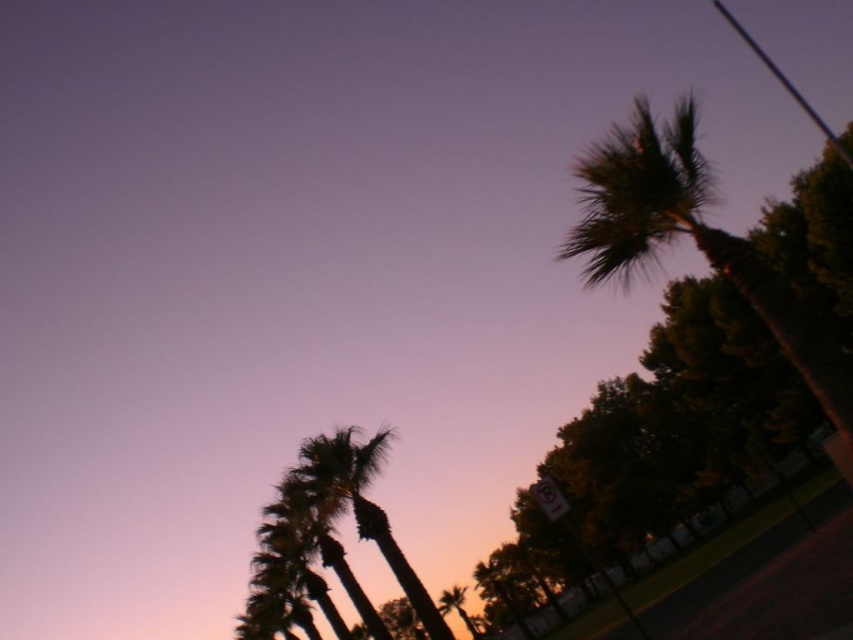
You are a photographer trying to capture the palm trees in the scene. Which palm tree, the dark green leafy palm tree at upper right or the silhouette leafy palm at lower left, would appear larger in your photo if both are in focus?

The dark green leafy palm tree at upper right would appear larger in the photo because it is closer to the viewer than the silhouette leafy palm at lower left.

You are standing at the center of the image and want to locate the dark green leafy palm tree at upper right. According to the coordinates provided, in which direction should you look to find it?

The dark green leafy palm tree at upper right is located at point 0.372 on the x axis and 0.810 on the y axis. Since the coordinates are given as fractions of the image width and height, the palm tree is positioned to the right and upper part of the image. Therefore, you should look to the upper right direction to locate it.

You are standing in the twilight scene and want to take a photo of both the point at coordinates point (747, 253) and point (315, 445). Which point will appear larger in your camera view?

A: Point (747, 253) is closer to the camera than point (315, 445), so it will appear larger in the camera view.